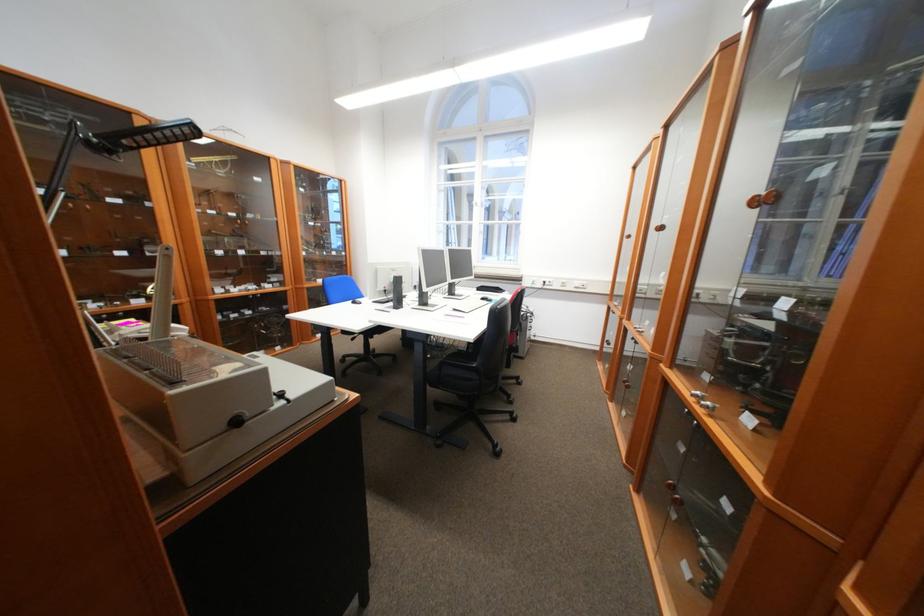
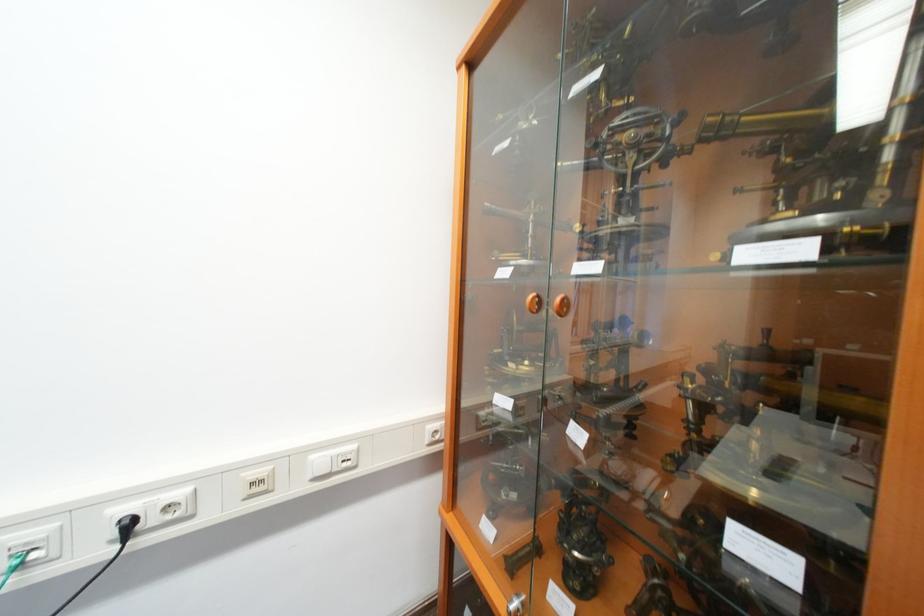
Locate, in the second image, the point that corresponds to [572,284] in the first image.

(261, 485)